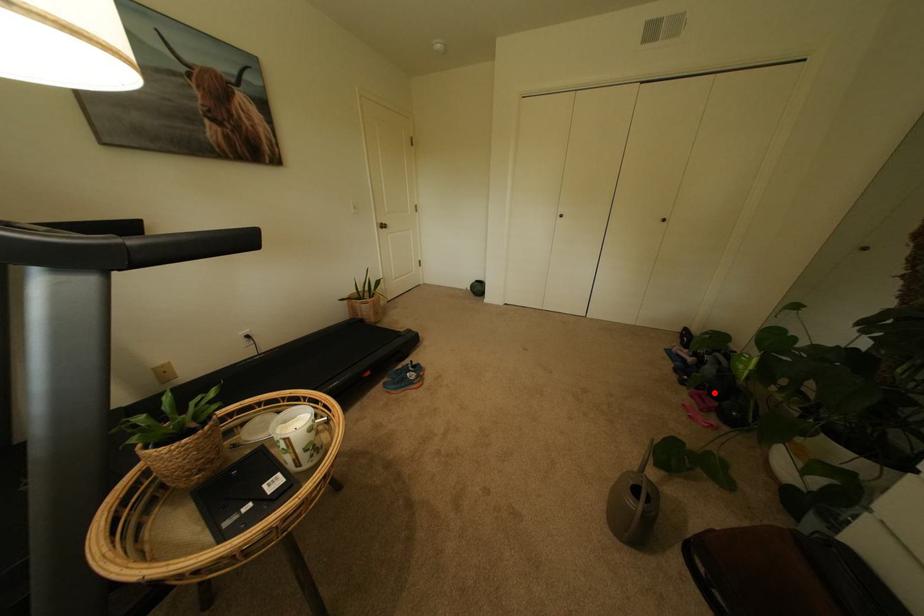
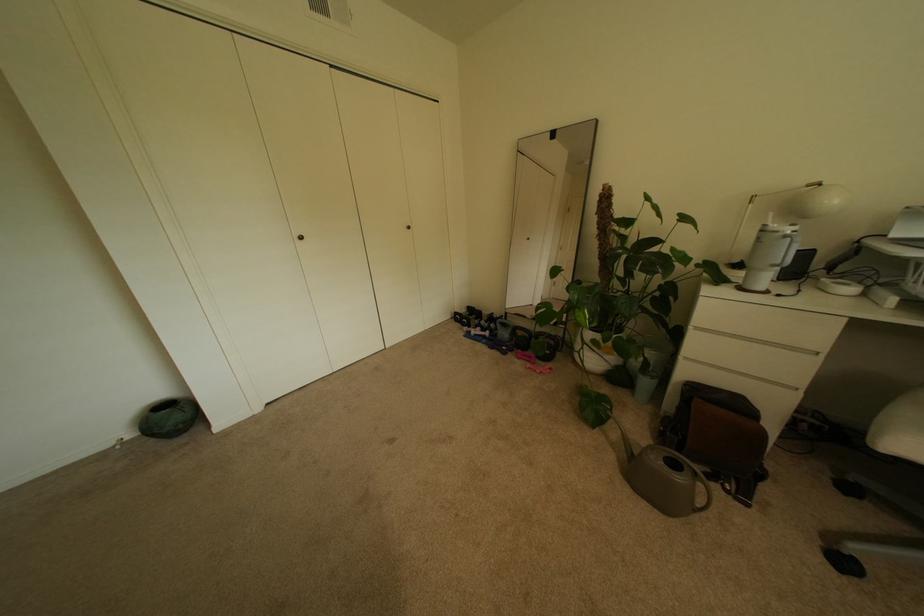
In the second image, find the point that corresponds to the highlighted location in the first image.

(524, 350)